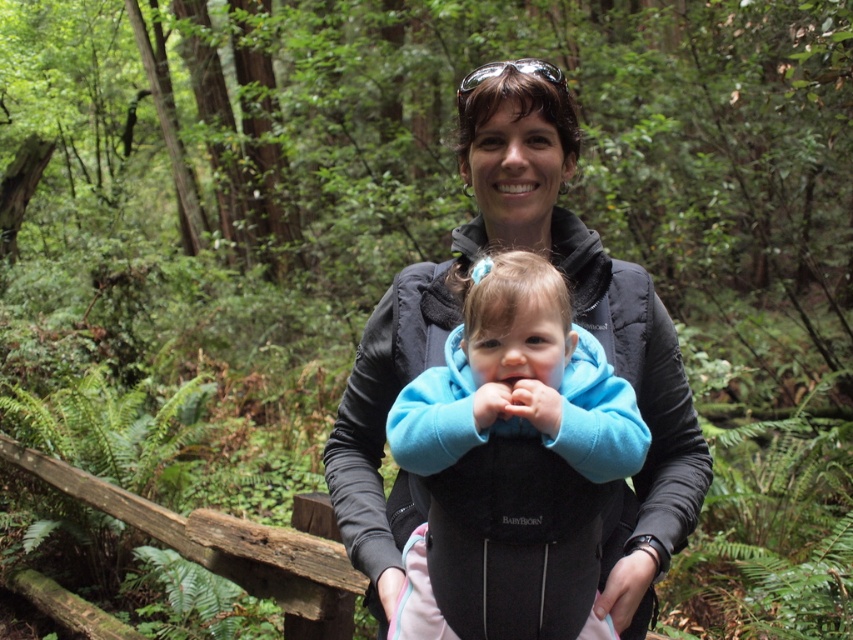
Does black softshell jacket at center have a smaller size compared to blue fleece baby at center?

Incorrect, black softshell jacket at center is not smaller in size than blue fleece baby at center.

Does black softshell jacket at center appear on the left side of blue fleece baby at center?

Yes, black softshell jacket at center is to the left of blue fleece baby at center.

Does point (614, 621) lie in front of point (634, 408)?

No.

This screenshot has width=853, height=640. I want to click on black softshell jacket at center, so click(514, 438).